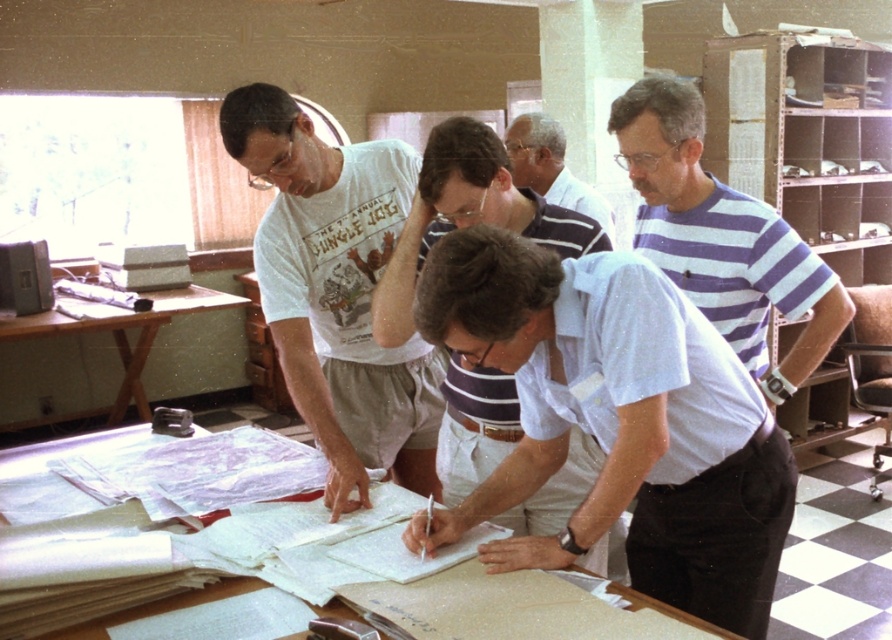
Between white cotton t-shirt at center and white striped shirt at upper center, which one is positioned lower?

white cotton t-shirt at center

Between white cotton t-shirt at center and white striped shirt at upper center, which one has less height?

Standing shorter between the two is white striped shirt at upper center.

Describe the element at coordinates (336, 292) in the screenshot. I see `white cotton t-shirt at center` at that location.

At what (x,y) coordinates should I click in order to perform the action: click on white cotton t-shirt at center. Please return your answer as a coordinate pair (x, y). This screenshot has height=640, width=892. Looking at the image, I should click on (336, 292).

Can you confirm if white cotton t-shirt at center is bigger than white paper at center?

Yes, white cotton t-shirt at center is bigger than white paper at center.

Which is above, white cotton t-shirt at center or white paper at center?

Positioned higher is white cotton t-shirt at center.

This screenshot has width=892, height=640. Find the location of `white cotton t-shirt at center`. white cotton t-shirt at center is located at coordinates (336, 292).

Can you confirm if white striped shirt at center is positioned above blue and white striped shirt at right?

No.

Which is behind, point (491, 296) or point (626, 161)?

Positioned behind is point (626, 161).

Does point (750, 445) come farther from viewer compared to point (727, 280)?

No, (750, 445) is in front of (727, 280).

At what (x,y) coordinates should I click in order to perform the action: click on white striped shirt at center. Please return your answer as a coordinate pair (x, y). Looking at the image, I should click on (616, 420).